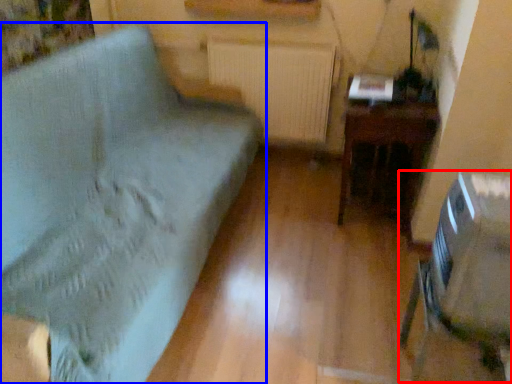
Question: Which point is closer to the camera, swivel chair (highlighted by a red box) or furniture (highlighted by a blue box)?

Choices:
 (A) swivel chair
 (B) furniture

Answer: (B)